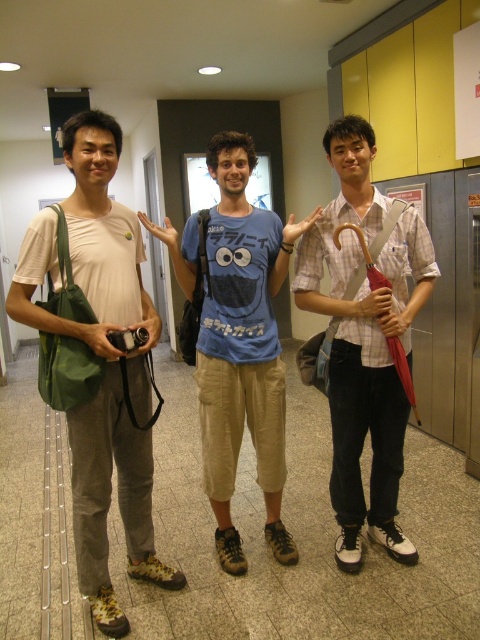
Question: Can you confirm if matte green bag at left is smaller than blue cotton t-shirt at center?

Choices:
 (A) yes
 (B) no

Answer: (A)

Question: Which is nearer to the blue cotton t-shirt at center?

Choices:
 (A) plaid cotton shirt at center
 (B) matte green bag at left

Answer: (A)

Question: Which of the following is the farthest from the observer?

Choices:
 (A) (x=180, y=284)
 (B) (x=38, y=256)

Answer: (A)

Question: Which is nearer to the matte green bag at left?

Choices:
 (A) blue cotton t-shirt at center
 (B) plaid cotton shirt at center

Answer: (A)

Question: Does matte green bag at left appear under blue cotton t-shirt at center?

Choices:
 (A) yes
 (B) no

Answer: (A)

Question: Is matte green bag at left behind plaid cotton shirt at center?

Choices:
 (A) yes
 (B) no

Answer: (B)